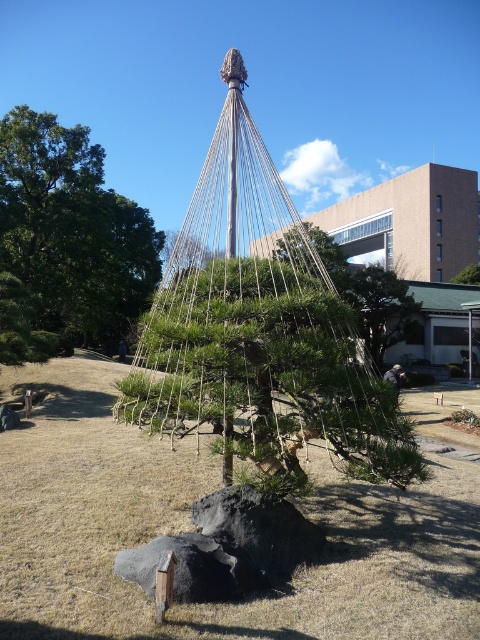
Question: Is green matte pine at center closer to the viewer compared to green leafy tree at center?

Choices:
 (A) yes
 (B) no

Answer: (A)

Question: Among these objects, which one is nearest to the camera?

Choices:
 (A) green matte pine at center
 (B) black rough rock at center
 (C) green leafy tree at upper left

Answer: (A)

Question: From the image, what is the correct spatial relationship of green matte pine at center in relation to green leafy tree at center?

Choices:
 (A) above
 (B) below

Answer: (B)

Question: Which is farther from the green leafy tree at center?

Choices:
 (A) black rough rock at center
 (B) green matte pine at center
 (C) green leafy tree at upper left

Answer: (A)

Question: Estimate the real-world distances between objects in this image. Which object is closer to the green leafy tree at center?

Choices:
 (A) black rough rock at center
 (B) green matte pine at center

Answer: (B)

Question: Is green matte pine at center smaller than black rough rock at center?

Choices:
 (A) yes
 (B) no

Answer: (B)